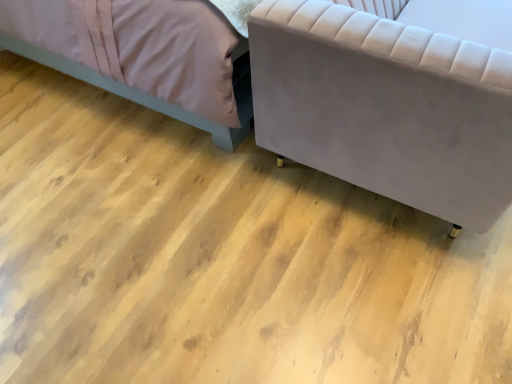
Describe the element at coordinates (385, 107) in the screenshot. I see `velvet gray couch at lower right` at that location.

Locate an element on the screen. This screenshot has height=384, width=512. velvet gray couch at lower right is located at coordinates (385, 107).

Consider the image. What is the approximate height of velvet gray couch at lower right?

The height of velvet gray couch at lower right is 30.02 inches.

You are a GUI agent. You are given a task and a screenshot of the screen. Output one action in this format:
    pyautogui.click(x=<x>, y=<y>)
    Task: Click on the velvet gray couch at lower right
    The height and width of the screenshot is (384, 512).
    Given the screenshot: What is the action you would take?
    pyautogui.click(x=385, y=107)